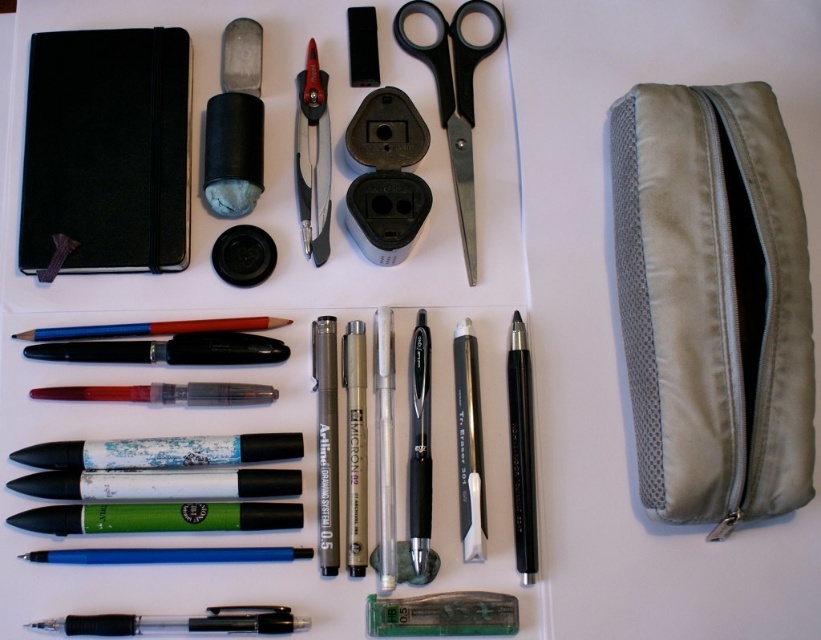
You are taking a photo of two points in the image. The first point is labeled as point (751, 268) and the second is point (475, 246). Which point will appear larger in your photo?

Point (751, 268) is closer to the camera than point (475, 246), so it will appear larger in the photo.